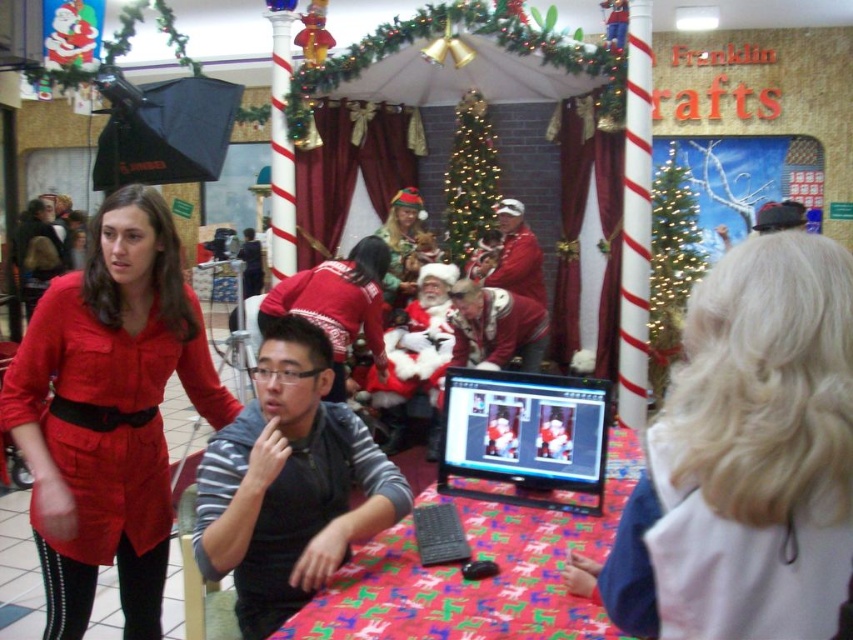
Between red glossy table at center and sweater at center, which one appears on the left side from the viewer's perspective?

sweater at center

Is red glossy table at center to the left of sweater at center from the viewer's perspective?

Incorrect, red glossy table at center is not on the left side of sweater at center.

Between point (345, 611) and point (386, 358), which one is positioned behind?

The point (386, 358) is more distant.

Locate an element on the screen. The height and width of the screenshot is (640, 853). red glossy table at center is located at coordinates (480, 580).

Who is more forward, (732, 305) or (509, 256)?

Point (732, 305) is in front.

Between point (718, 531) and point (531, 250), which one is positioned behind?

The point (531, 250) is behind.

This screenshot has width=853, height=640. Identify the location of blonde hair at upper right. (747, 458).

Is matte black monitor at center to the right of sweater at center from the viewer's perspective?

Yes, matte black monitor at center is to the right of sweater at center.

Locate an element on the screen. The image size is (853, 640). matte black monitor at center is located at coordinates (524, 435).

The width and height of the screenshot is (853, 640). Find the location of `matte black monitor at center`. matte black monitor at center is located at coordinates (524, 435).